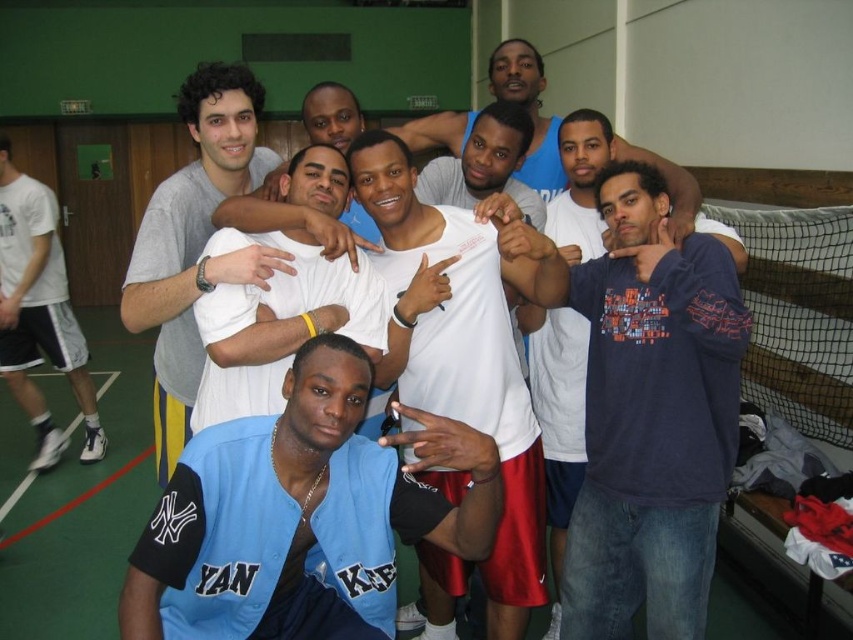
Question: Considering the real-world distances, which object is closest to the white matte t-shirt at center?

Choices:
 (A) white cotton t-shirt at left
 (B) white matte tank top at center

Answer: (B)

Question: Which of the following is the farthest from the observer?

Choices:
 (A) white cotton t-shirt at left
 (B) white matte tank top at center
 (C) matte gray t-shirt at upper left
 (D) white matte shirt at center

Answer: (A)

Question: Can you confirm if matte gray t-shirt at upper left is thinner than white matte shirt at center?

Choices:
 (A) yes
 (B) no

Answer: (B)

Question: Is light blue jersey at center closer to the viewer compared to white cotton t-shirt at left?

Choices:
 (A) yes
 (B) no

Answer: (A)

Question: Based on their relative distances, which object is nearer to the white matte tank top at center?

Choices:
 (A) dark blue cotton shirt at center
 (B) white cotton t-shirt at left
 (C) light blue jersey at center

Answer: (A)

Question: Is white matte tank top at center bigger than white cotton t-shirt at left?

Choices:
 (A) yes
 (B) no

Answer: (B)